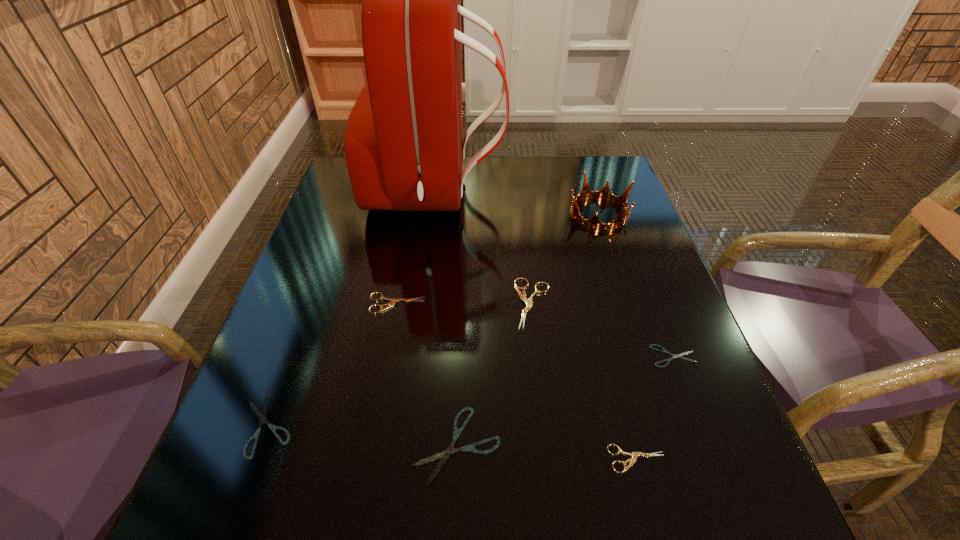
At what (x,y) coordinates should I click in order to perform the action: click on free area in between the rightmost black shears and the second smallest black shears. Please return your answer as a coordinate pair (x, y). Looking at the image, I should click on (470, 391).

Find the location of a particular element. The height and width of the screenshot is (540, 960). empty space between the leftmost shears and the seventh shortest object is located at coordinates (433, 319).

The image size is (960, 540). I want to click on vacant point located between the tallest object and the second shears from left to right, so click(417, 247).

Where is `free area in between the leftmost shears and the second shears from left to right`? Image resolution: width=960 pixels, height=540 pixels. free area in between the leftmost shears and the second shears from left to right is located at coordinates (332, 364).

The width and height of the screenshot is (960, 540). Identify the location of vacant area that lies between the crown and the nearest beige shears. (618, 336).

Locate an element on the screen. The height and width of the screenshot is (540, 960). the fifth closest object to the second black shears from left to right is located at coordinates (663, 350).

The width and height of the screenshot is (960, 540). Find the location of `object that stands as the third closest to the pink backpack`. object that stands as the third closest to the pink backpack is located at coordinates (394, 300).

This screenshot has width=960, height=540. I want to click on shears that can be found as the fifth closest to the second tallest shears, so click(663, 350).

Identify the location of shears that is the fourth closest to the shortest object. (394, 300).

Identify which beige shears is the second closest to the nearest beige shears. Please provide its 2D coordinates. Your answer should be formatted as a tuple, i.e. [(x, y)], where the tuple contains the x and y coordinates of a point satisfying the conditions above.

[(394, 300)]